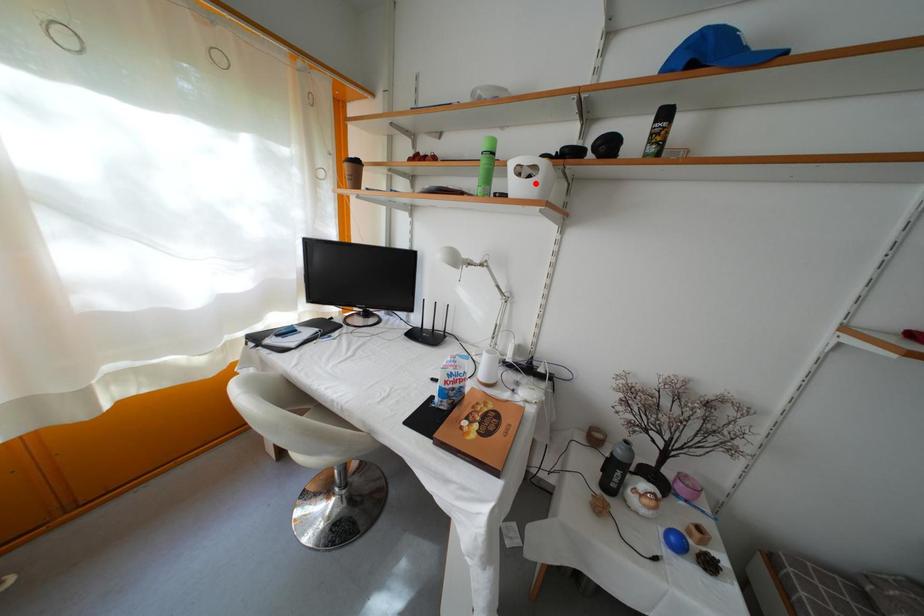
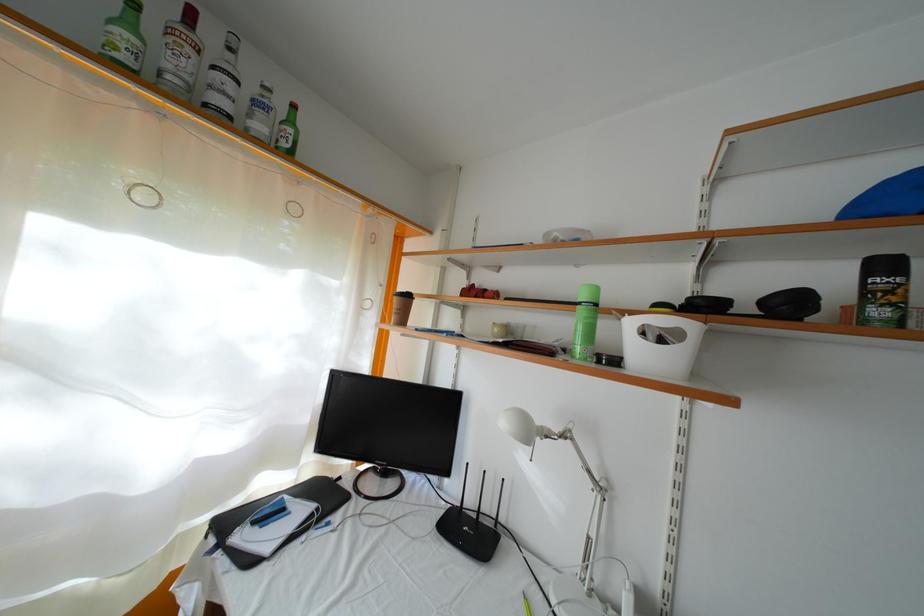
Find the pixel in the second image that matches the highlighted location in the first image.

(667, 346)